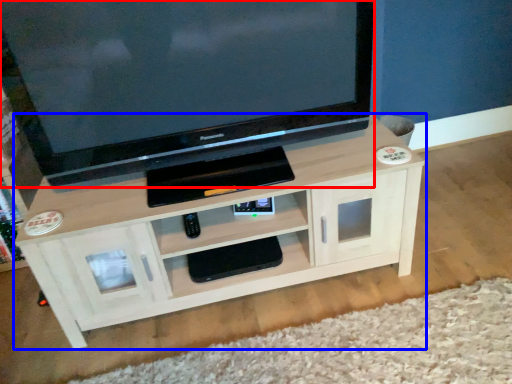
Question: Which object appears farthest to the camera in this image, television (highlighted by a red box) or shelf (highlighted by a blue box)?

Choices:
 (A) television
 (B) shelf

Answer: (B)